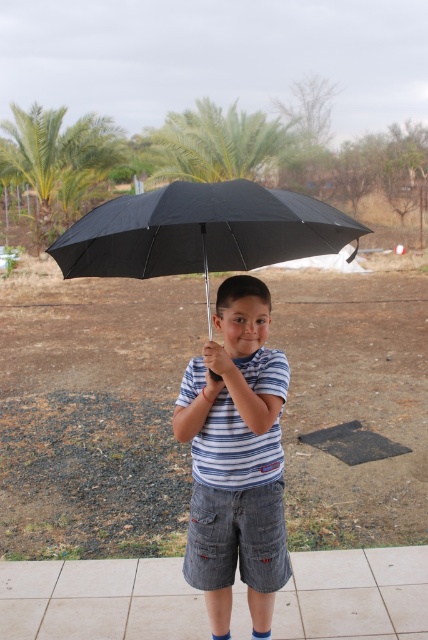
Consider the image. You are the boy holding the black matte umbrella at center. You want to look up at the green leafy palm tree at upper center. Can you see it without moving the umbrella?

The black matte umbrella at center is below the green leafy palm tree at upper center, so the boy can look up and see the green leafy palm tree at upper center without moving the umbrella since it is positioned above him.

You are a photographer taking a picture of the boy under the black umbrella. You notice two points in the scene at coordinates point [74,248] and point [204,161]. Which point is closer to your camera lens?

Point [74,248] is closer to the camera than point [204,161].

You are a drone operator trying to capture a photo of the boy under the umbrella. You need to ensure the green leafy palm tree at upper left and the green leafy palm tree at upper center donot block the view. Based on their positions, which palm tree is closer to the camera so you can adjust the angle?

The green leafy palm tree at upper left is closer to the camera than the green leafy palm tree at upper center because it is positioned below it in the frame.